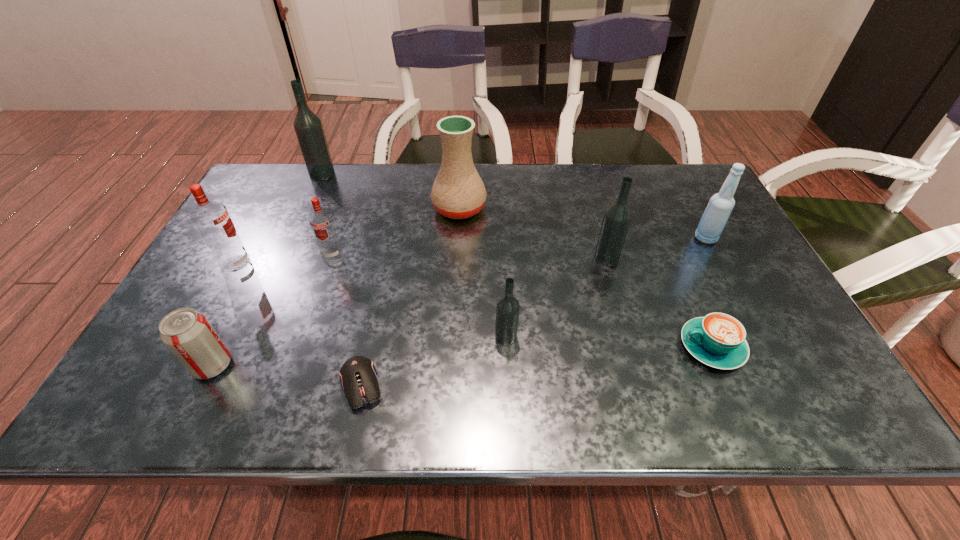
Where is `the nearest vodka`? the nearest vodka is located at coordinates (507, 309).

The height and width of the screenshot is (540, 960). I want to click on the second vodka from right to left, so click(x=507, y=309).

The image size is (960, 540). Identify the location of the fourth object from left to right. (321, 220).

Where is `the right red vodka`? The width and height of the screenshot is (960, 540). the right red vodka is located at coordinates (321, 220).

Locate an element on the screen. soda can is located at coordinates coord(187,333).

At what (x,y) coordinates should I click in order to perform the action: click on the third shortest object. Please return your answer as a coordinate pair (x, y). Looking at the image, I should click on (187, 333).

Locate an element on the screen. Image resolution: width=960 pixels, height=540 pixels. cappuccino is located at coordinates (718, 340).

The height and width of the screenshot is (540, 960). I want to click on the ninth object from left to right, so point(718,340).

The height and width of the screenshot is (540, 960). Find the location of `the fifth object from left to right`. the fifth object from left to right is located at coordinates (358, 376).

Where is `black computer mouse`? The width and height of the screenshot is (960, 540). black computer mouse is located at coordinates (358, 376).